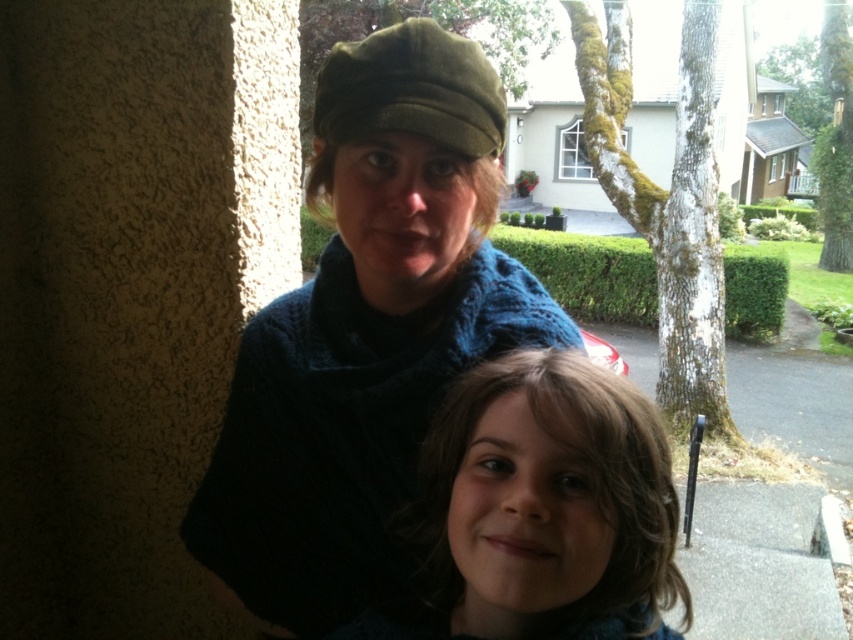
Question: Does knitted dark blue sweater at center have a lesser width compared to brown curly hair at lower center?

Choices:
 (A) yes
 (B) no

Answer: (B)

Question: Does knitted dark blue sweater at center come behind brown curly hair at lower center?

Choices:
 (A) no
 (B) yes

Answer: (B)

Question: Among these objects, which one is nearest to the camera?

Choices:
 (A) knitted dark blue sweater at center
 (B) brown curly hair at lower center

Answer: (B)

Question: Is knitted dark blue sweater at center closer to the viewer compared to brown curly hair at lower center?

Choices:
 (A) yes
 (B) no

Answer: (B)

Question: Which object is closer to the camera taking this photo?

Choices:
 (A) knitted dark blue sweater at center
 (B) brown curly hair at lower center

Answer: (B)